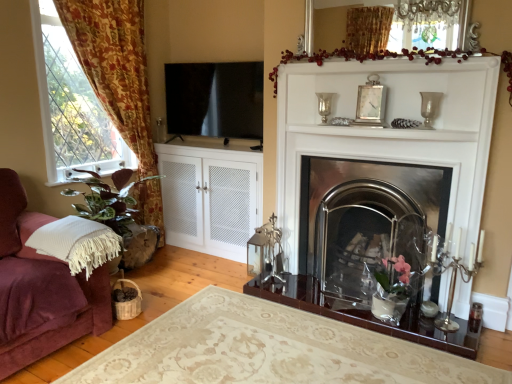
Question: From the image's perspective, is polished stainless steel fireplace at center below clear glass vase at upper center, which is the first candle holder in left-to-right order?

Choices:
 (A) no
 (B) yes

Answer: (B)

Question: Considering the relative sizes of polished stainless steel fireplace at center and clear glass vase at upper center, which is counted as the third candle holder, starting from the right, in the image provided, is polished stainless steel fireplace at center smaller than clear glass vase at upper center, which is counted as the third candle holder, starting from the right,?

Choices:
 (A) no
 (B) yes

Answer: (A)

Question: From the image's perspective, is polished stainless steel fireplace at center on clear glass vase at upper center, which is counted as the third candle holder, starting from the right?

Choices:
 (A) yes
 (B) no

Answer: (B)

Question: Is the position of polished stainless steel fireplace at center less distant than that of clear glass vase at upper center, the third candle holder positioned from the bottom?

Choices:
 (A) no
 (B) yes

Answer: (B)

Question: From a real-world perspective, does polished stainless steel fireplace at center stand above clear glass vase at upper center, which is counted as the third candle holder, starting from the right?

Choices:
 (A) yes
 (B) no

Answer: (B)

Question: From the image's perspective, relative to floral fabric curtain at left, is clear glass vase at upper right, placed as the 2th candle holder when sorted from right to left, above or below?

Choices:
 (A) above
 (B) below

Answer: (B)

Question: Considering their positions, is clear glass vase at upper right, placed as the 2th candle holder when sorted from right to left, located in front of or behind floral fabric curtain at left?

Choices:
 (A) behind
 (B) front

Answer: (B)

Question: Looking at their shapes, would you say clear glass vase at upper right, the 2th candle holder from the bottom, is wider or thinner than floral fabric curtain at left?

Choices:
 (A) thin
 (B) wide

Answer: (A)

Question: From a real-world perspective, is clear glass vase at upper right, the 2th candle holder from the bottom, above or below floral fabric curtain at left?

Choices:
 (A) above
 (B) below

Answer: (A)

Question: From their relative heights in the image, would you say silver metallic candle holder at right, the 1th candle holder when ordered from right to left, is taller or shorter than clear glass vase at upper right, which is counted as the 2th candle holder, starting from the top?

Choices:
 (A) tall
 (B) short

Answer: (A)

Question: Does point (477, 256) appear closer or farther from the camera than point (428, 109)?

Choices:
 (A) farther
 (B) closer

Answer: (B)

Question: Is silver metallic candle holder at right, which is counted as the third candle holder, starting from the top, to the left or to the right of clear glass vase at upper right, which is the second candle holder in left-to-right order, in the image?

Choices:
 (A) left
 (B) right

Answer: (B)

Question: Is silver metallic candle holder at right, the third candle holder viewed from the left, wider or thinner than clear glass vase at upper right, the 2th candle holder from the bottom?

Choices:
 (A) thin
 (B) wide

Answer: (B)

Question: From a real-world perspective, is white glossy mantle at center above or below clear glass vase at upper right, which is the second candle holder in left-to-right order?

Choices:
 (A) below
 (B) above

Answer: (A)

Question: Looking at their shapes, would you say white glossy mantle at center is wider or thinner than clear glass vase at upper right, the 2th candle holder from the bottom?

Choices:
 (A) wide
 (B) thin

Answer: (A)